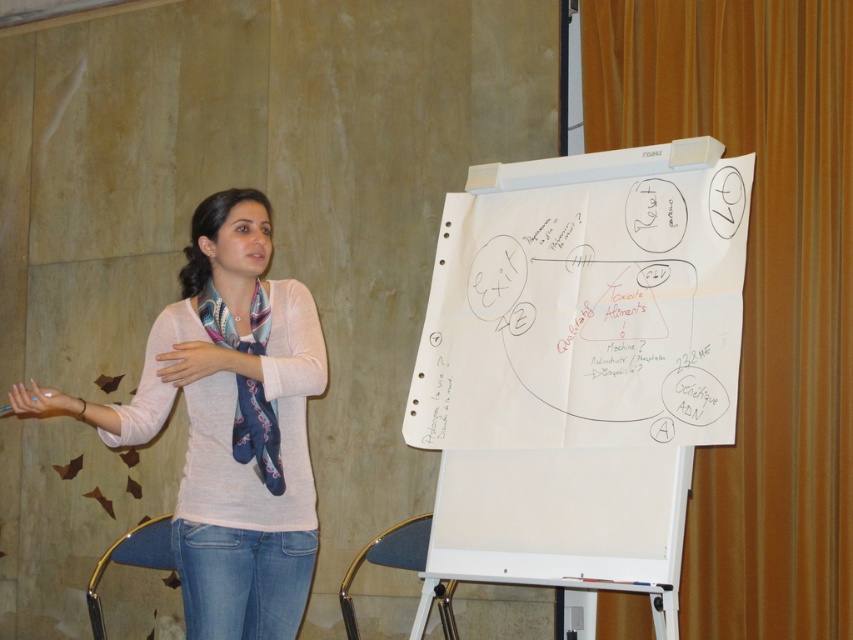
Question: Where is white paperboard at center located in relation to silky blue scarf at left in the image?

Choices:
 (A) right
 (B) left

Answer: (A)

Question: Is the position of light pink sweater at center more distant than that of silky blue scarf at left?

Choices:
 (A) yes
 (B) no

Answer: (B)

Question: Considering the real-world distances, which object is farthest from the white paperboard at center?

Choices:
 (A) light pink sweater at center
 (B) silky blue scarf at left

Answer: (B)

Question: Which of these objects is positioned farthest from the white paperboard at center?

Choices:
 (A) light pink sweater at center
 (B) silky blue scarf at left

Answer: (B)

Question: From the image, what is the correct spatial relationship of light pink sweater at center in relation to silky blue scarf at left?

Choices:
 (A) right
 (B) left

Answer: (B)

Question: Which point is farther to the camera?

Choices:
 (A) (199, 515)
 (B) (252, 419)

Answer: (B)